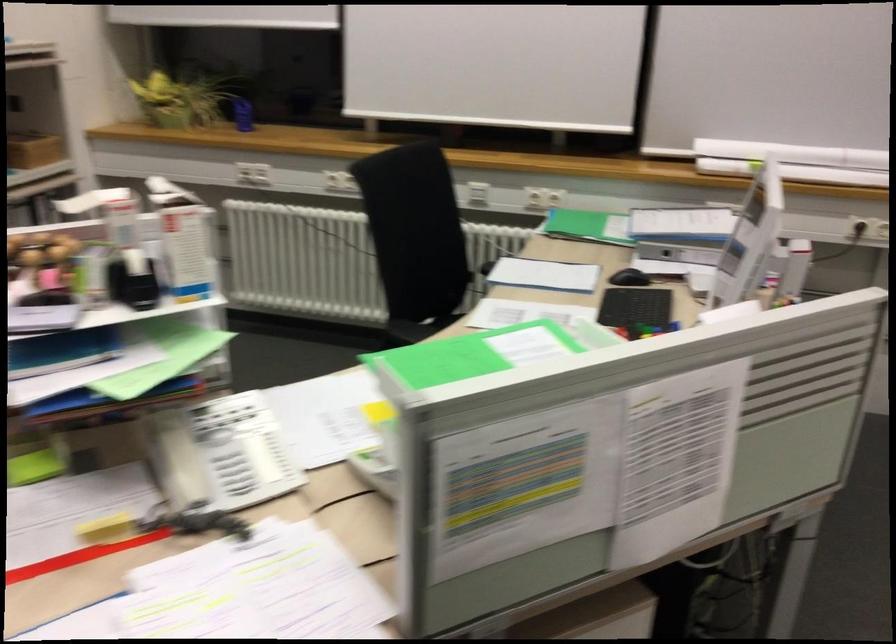
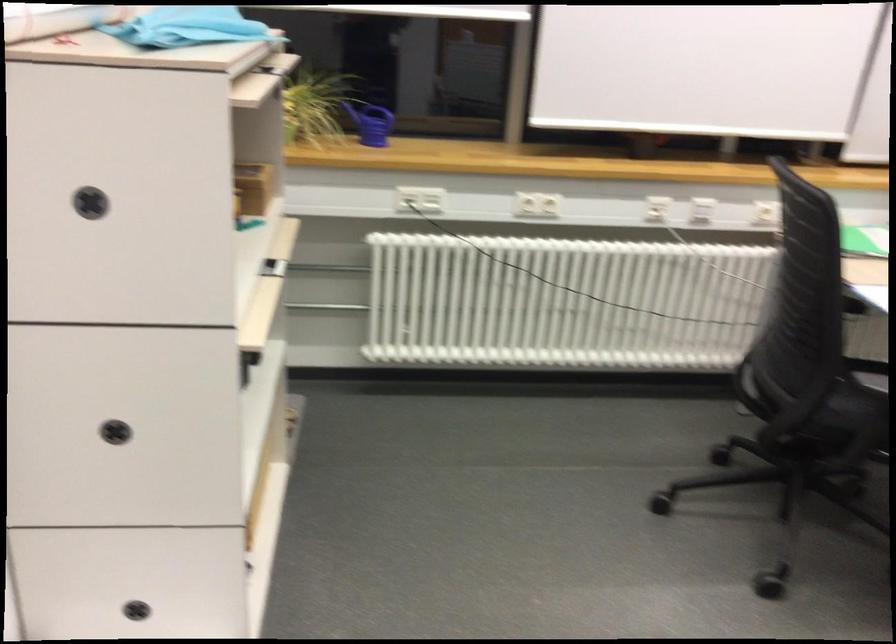
The point at [268,169] is marked in the first image. Where is the corresponding point in the second image?

(419, 199)